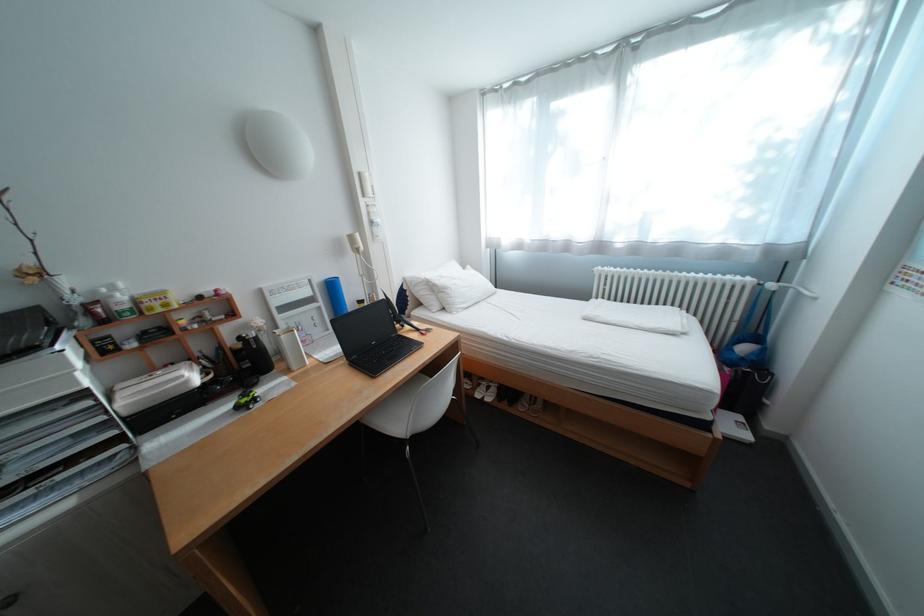
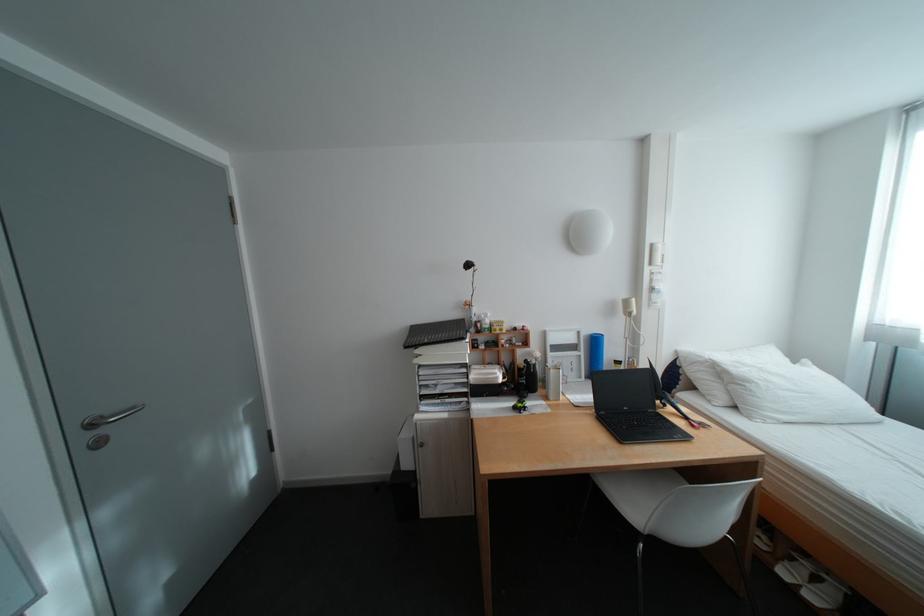
Locate, in the second image, the point that corresponds to point 371,175 in the first image.

(664, 246)